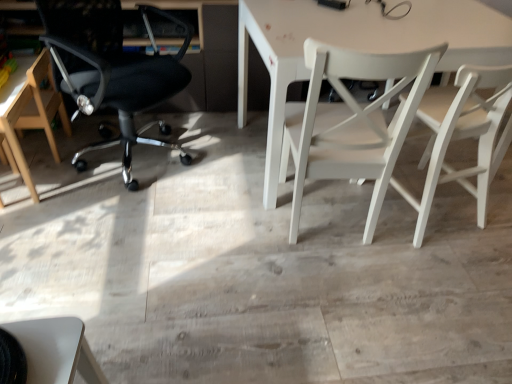
Where is `free space between black mesh office chair at left, the 2th chair in the left-to-right sequence, and light brown wooden chair at left, which is the 1th chair from left to right`? free space between black mesh office chair at left, the 2th chair in the left-to-right sequence, and light brown wooden chair at left, which is the 1th chair from left to right is located at coordinates coord(76,175).